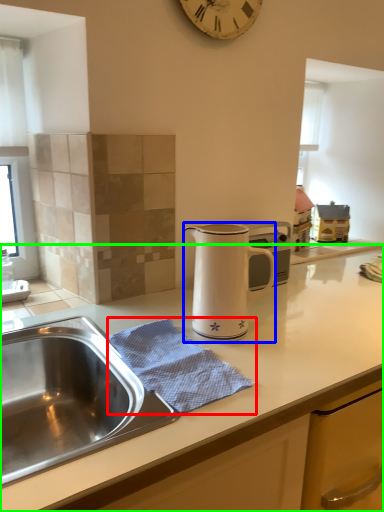
Question: Which is nearer to the blanket (highlighted by a red box)? jug (highlighted by a blue box) or countertop (highlighted by a green box).

Choices:
 (A) jug
 (B) countertop

Answer: (B)